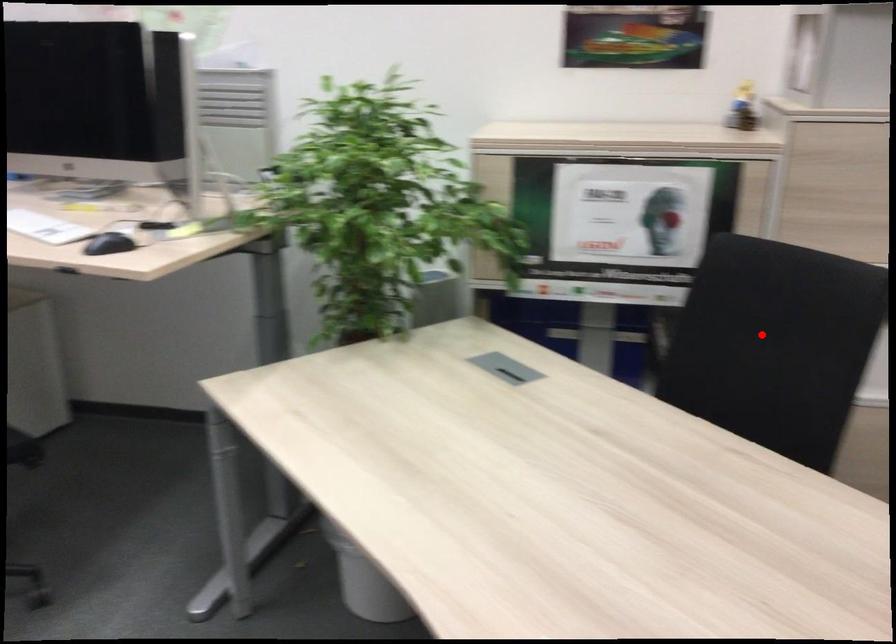
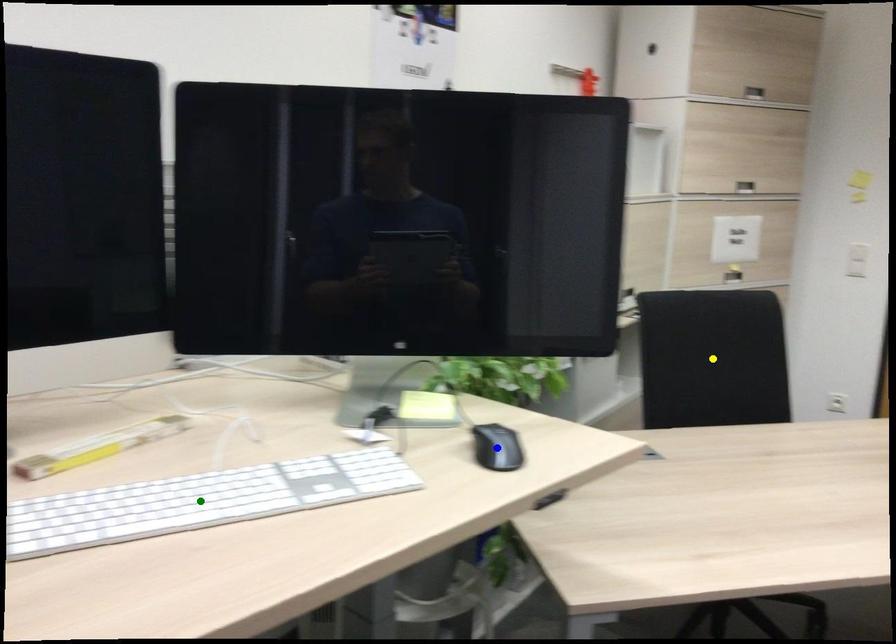
Question: I am providing you with two images of the same scene from different viewpoints. A red point is marked on the first image. You are given multiple points on the second image. In image 2, which mark is for the same physical point as the one in image 1?

Choices:
 (A) green point
 (B) blue point
 (C) yellow point

Answer: (C)